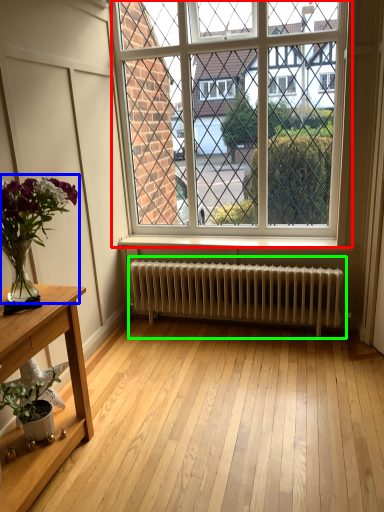
Question: Estimate the real-world distances between objects in this image. Which object is farther from window (highlighted by a red box), houseplant (highlighted by a blue box) or radiator (highlighted by a green box)?

Choices:
 (A) houseplant
 (B) radiator

Answer: (A)